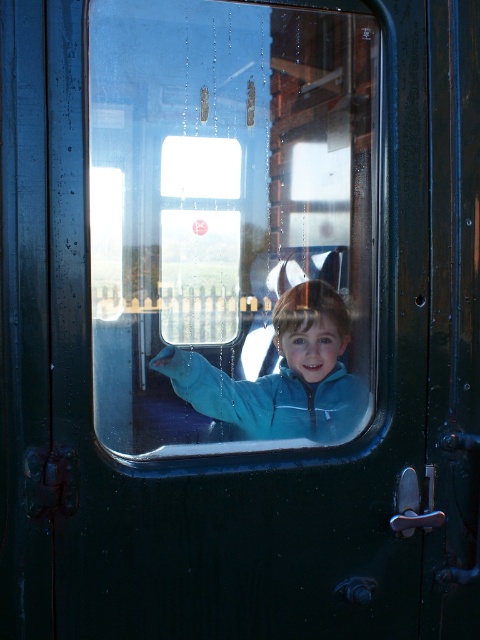
You are the child in the train car. You see two points marked on the window. Which point is closer to you, the point at coordinates (107, 4) or the point at (324, 336)?

The point at coordinates (107, 4) is closer to you because it is in front of the point at (324, 336).

You are a passenger on the train and you want to look outside through the transparent glass train window at center. However, your blue fleece jacket at center is blocking your view. Which direction should you move your jacket to see through the window?

You should move your blue fleece jacket at center to the right because the transparent glass train window at center is located to the left of the blue fleece jacket at center.

You are a passenger sitting in the train car. You notice the transparent glass train window at center and the blue fleece jacket at center. Which object is closer to you?

The transparent glass train window at center is closer to the viewer than the blue fleece jacket at center. Therefore, the transparent glass train window at center is closer to you.